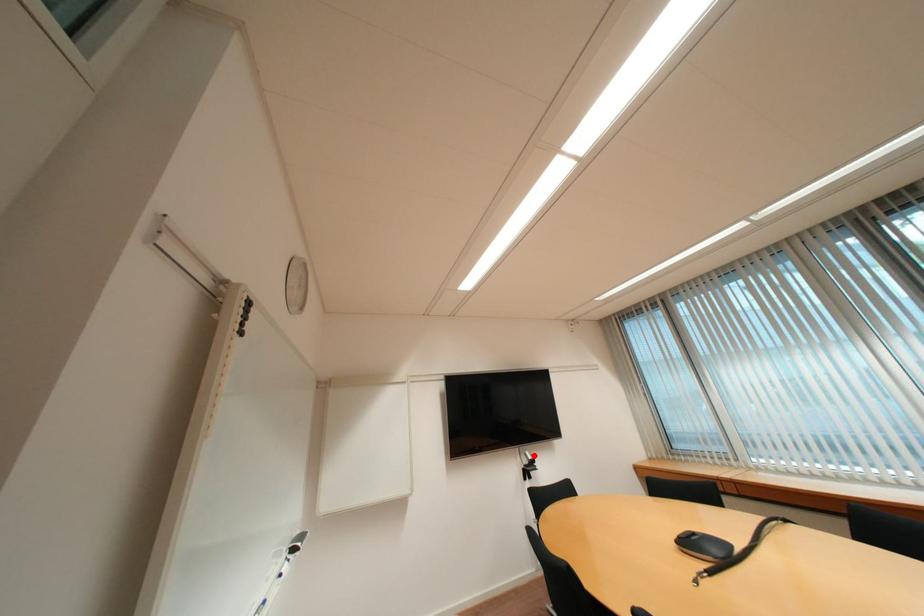
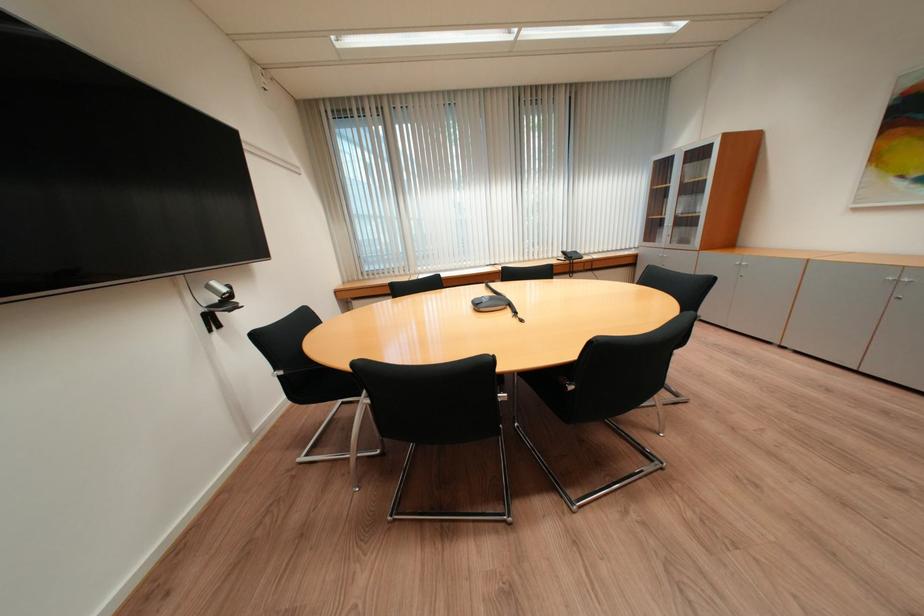
Question: A red point is marked in image1. In image2, is the corresponding 3D point closer to the camera or farther? Reply with the corresponding letter.

Choices:
 (A) The corresponding 3D point is closer.
 (B) The corresponding 3D point is farther.

Answer: (A)